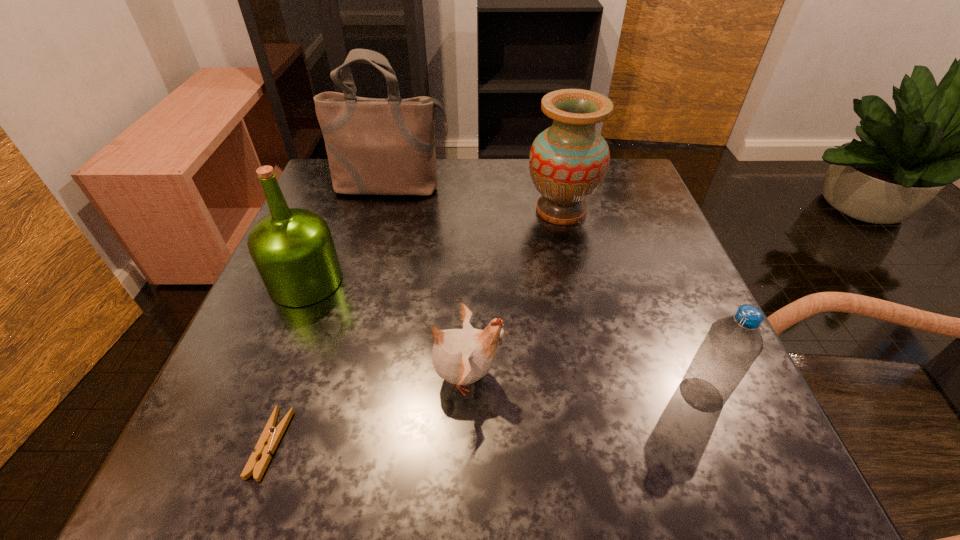
Identify the location of vase that is at the right edge. The height and width of the screenshot is (540, 960). (568, 162).

Where is `water bottle that is at the right edge`? water bottle that is at the right edge is located at coordinates (732, 344).

At what (x,y) coordinates should I click in order to perform the action: click on object at the far left corner. Please return your answer as a coordinate pair (x, y). The image size is (960, 540). Looking at the image, I should click on (374, 146).

Identify the location of object that is at the near left corner. [x=271, y=435].

Locate an element on the screen. object at the far right corner is located at coordinates click(568, 162).

Where is `vacant space at the far edge of the desktop`? The width and height of the screenshot is (960, 540). vacant space at the far edge of the desktop is located at coordinates (438, 197).

The image size is (960, 540). In the image, there is a desktop. What are the coordinates of `vacant area at the left edge` in the screenshot? It's located at (323, 363).

Identify the location of blank space at the right edge. This screenshot has height=540, width=960. (678, 383).

Find the location of a particular element. This screenshot has height=540, width=960. free location at the far left corner of the desktop is located at coordinates (327, 171).

This screenshot has height=540, width=960. In the image, there is a desktop. In order to click on vacant space at the near left corner in this screenshot , I will do `click(196, 436)`.